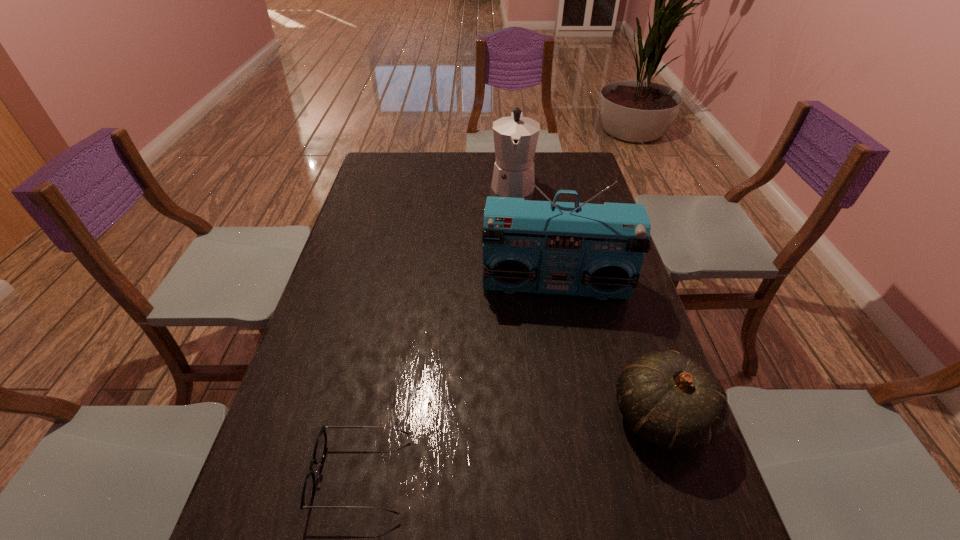
The image size is (960, 540). I want to click on the shortest object, so click(308, 491).

Image resolution: width=960 pixels, height=540 pixels. Identify the location of the leftmost object. (308, 491).

I want to click on the third tallest object, so click(x=671, y=402).

At what (x,y) coordinates should I click in order to perform the action: click on radio receiver. Please return your answer as a coordinate pair (x, y). Looking at the image, I should click on (596, 250).

Locate an element on the screen. the third shortest object is located at coordinates (515, 137).

Where is `the farthest object`? the farthest object is located at coordinates (515, 137).

At what (x,y) coordinates should I click in order to perform the action: click on vacant space located on the back of the gourd. Please return your answer as a coordinate pair (x, y). This screenshot has width=960, height=540. Looking at the image, I should click on (640, 354).

This screenshot has height=540, width=960. In order to click on vacant area situated on the front-facing side of the radio receiver in this screenshot , I will do `click(554, 365)`.

The image size is (960, 540). In order to click on vacant area located on the front-facing side of the radio receiver in this screenshot , I will do `click(556, 433)`.

This screenshot has height=540, width=960. I want to click on free space located on the front-facing side of the radio receiver, so click(x=554, y=382).